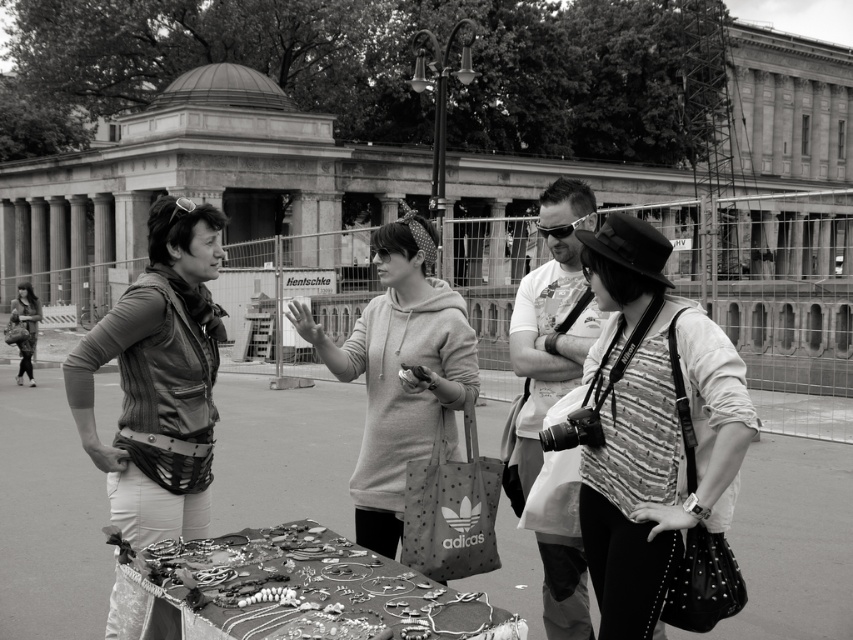
Question: Which point is closer to the camera?

Choices:
 (A) click(x=569, y=384)
 (B) click(x=18, y=314)

Answer: (A)

Question: Can you confirm if striped fabric shirt at center is positioned to the left of matte white t-shirt at center?

Choices:
 (A) no
 (B) yes

Answer: (A)

Question: Which object is positioned closest to the matte white t-shirt at center?

Choices:
 (A) light gray hoodie at center
 (B) striped fabric shirt at center
 (C) leather jacket at center
 (D) matte black jacket at left

Answer: (B)

Question: Is leather jacket at center bigger than light gray hoodie at center?

Choices:
 (A) no
 (B) yes

Answer: (A)

Question: Which of the following is the closest to the observer?

Choices:
 (A) leather jacket at center
 (B) light gray hoodie at center
 (C) striped fabric shirt at center
 (D) matte white t-shirt at center

Answer: (C)

Question: Is matte white t-shirt at center above matte black jacket at left?

Choices:
 (A) yes
 (B) no

Answer: (A)